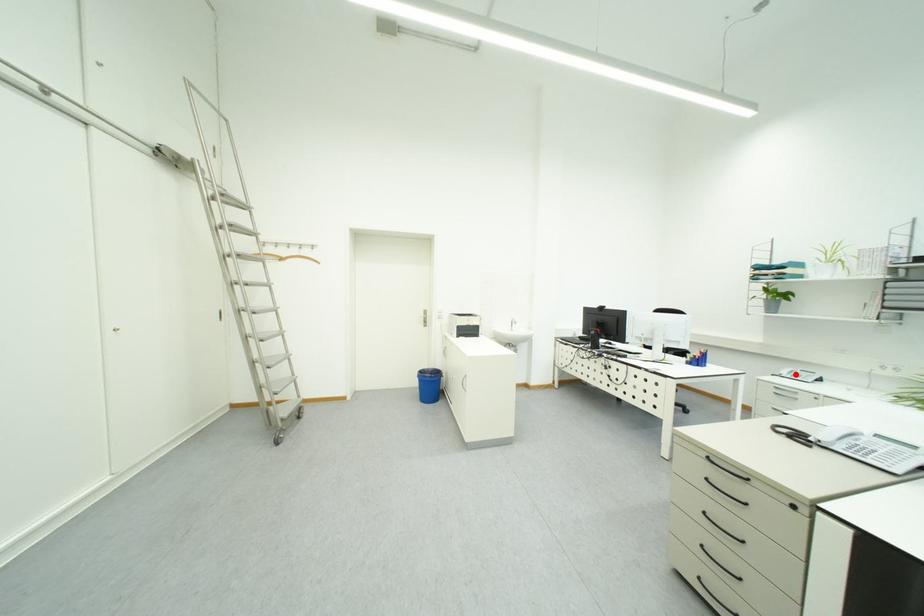
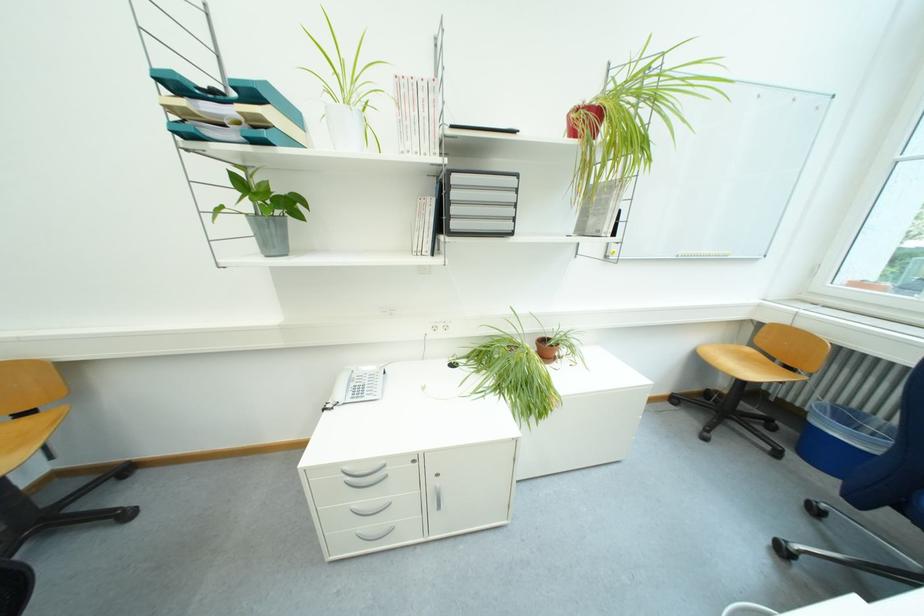
Locate, in the second image, the point that corresponds to the highlighted location in the first image.

(351, 395)